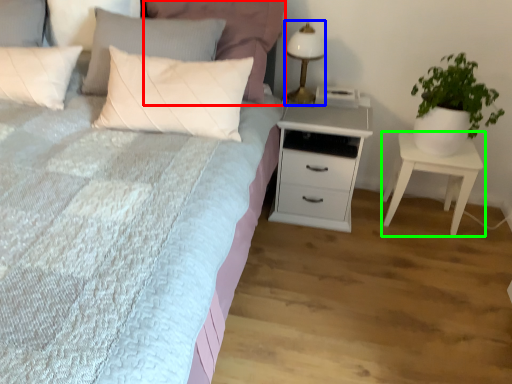
Question: Which is farther away from pillow (highlighted by a red box)? bedside lamp (highlighted by a blue box) or nightstand (highlighted by a green box)?

Choices:
 (A) bedside lamp
 (B) nightstand

Answer: (B)